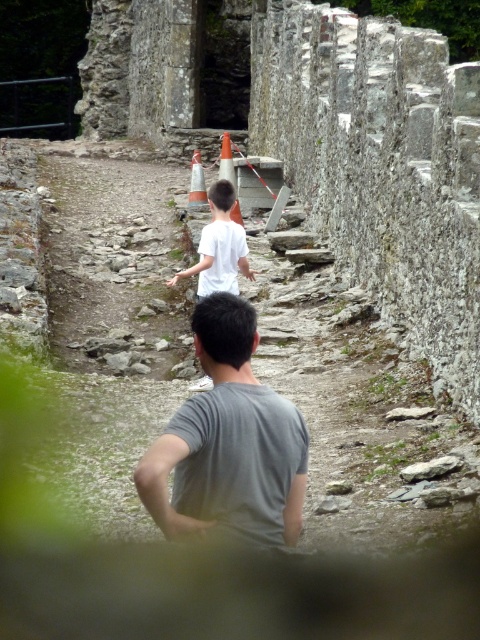
Question: Does gray matte shirt at center have a lesser width compared to white matte shirt at center?

Choices:
 (A) no
 (B) yes

Answer: (B)

Question: Which point is farther from the camera taking this photo?

Choices:
 (A) (243, 269)
 (B) (242, 346)

Answer: (A)

Question: Is gray matte shirt at center to the right of white matte shirt at center from the viewer's perspective?

Choices:
 (A) yes
 (B) no

Answer: (A)

Question: Is gray matte shirt at center thinner than white matte shirt at center?

Choices:
 (A) yes
 (B) no

Answer: (A)

Question: Which of the following is the farthest from the observer?

Choices:
 (A) (241, 259)
 (B) (280, 472)
 (C) (197, 170)

Answer: (C)

Question: Which point appears closest to the camera in this image?

Choices:
 (A) (204, 253)
 (B) (204, 200)

Answer: (A)